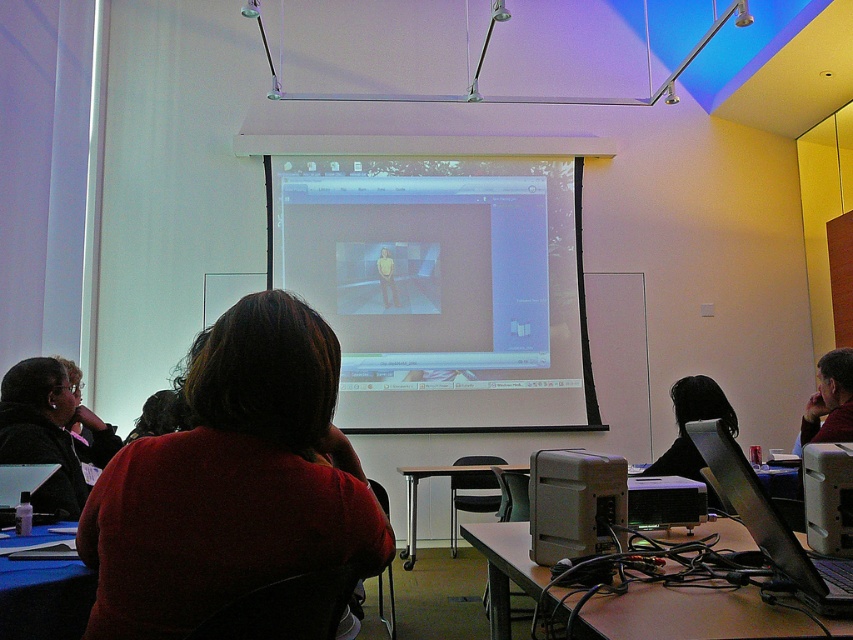
Who is positioned more to the left, matte black projector at center or matte black laptop at lower left?

Positioned to the left is matte black laptop at lower left.

Can you confirm if matte black projector at center is thinner than matte black laptop at lower left?

Incorrect, matte black projector at center's width is not less than matte black laptop at lower left's.

Which is behind, point (672, 480) or point (18, 484)?

Point (672, 480)

At what (x,y) coordinates should I click in order to perform the action: click on matte black projector at center. Please return your answer as a coordinate pair (x, y). Looking at the image, I should click on (665, 500).

Does white glossy projection screen at center have a greater width compared to wooden table at lower center?

A: Yes.

Which is behind, point (444, 220) or point (492, 630)?

The point (444, 220) is more distant.

Locate an element on the screen. The width and height of the screenshot is (853, 640). white glossy projection screen at center is located at coordinates (440, 285).

Between dark red sweater at center and wooden desk at center, which one is positioned lower?

Positioned lower is wooden desk at center.

Is dark red sweater at center closer to camera compared to wooden desk at center?

Yes, dark red sweater at center is closer to the viewer.

The height and width of the screenshot is (640, 853). Identify the location of dark red sweater at center. (231, 481).

The height and width of the screenshot is (640, 853). I want to click on dark red sweater at center, so click(231, 481).